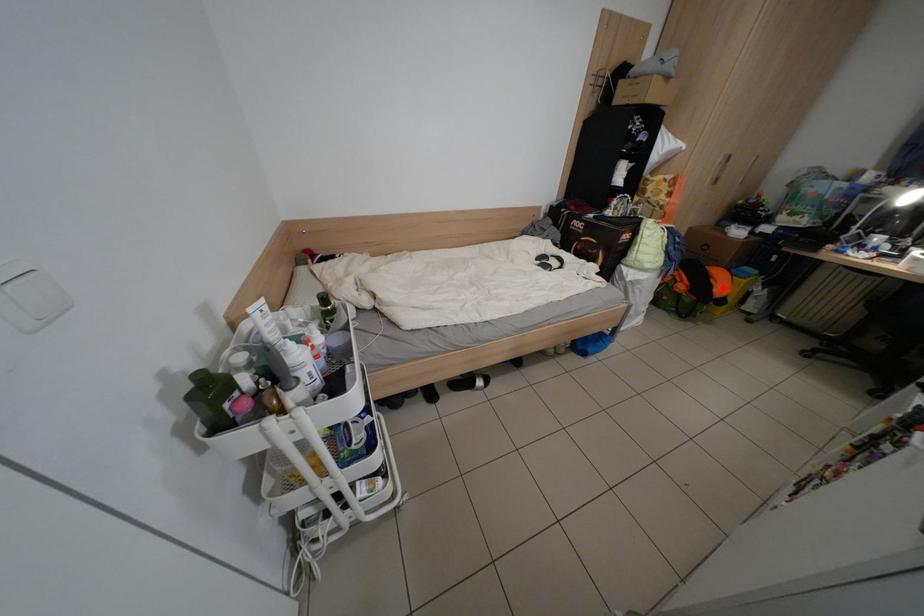
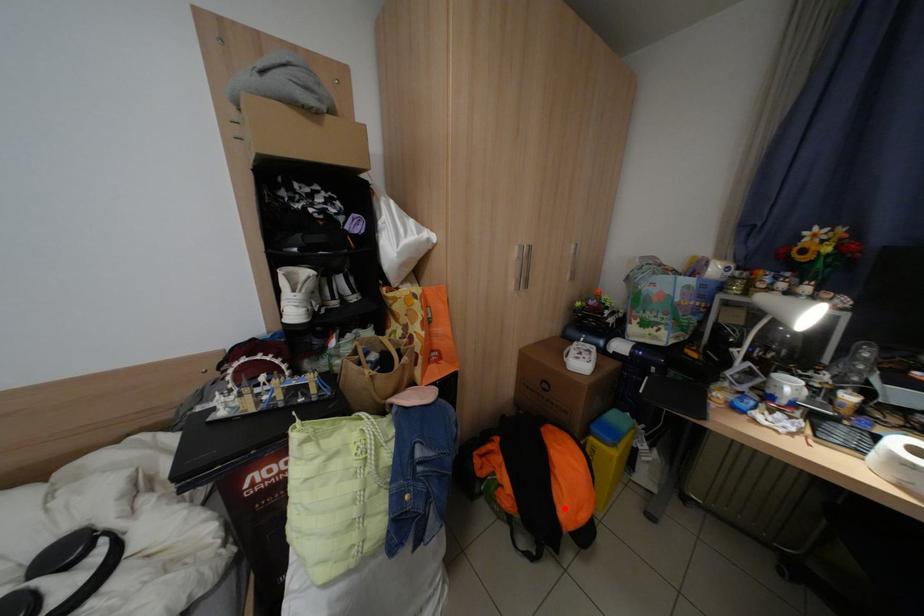
Based on the photo, I am providing you with two images of the same scene from different viewpoints. A red point is marked on the first image and another point is marked on the second image. Is the red point in image1 aligned with the point shown in image2?

Yes